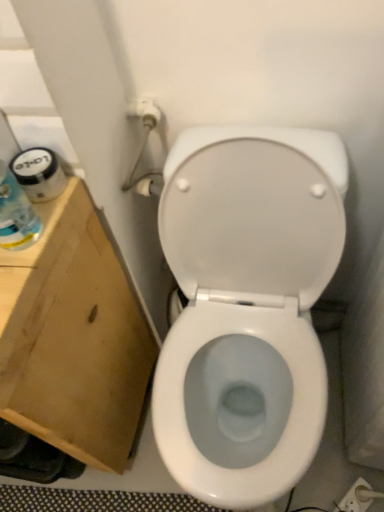
Question: From a real-world perspective, is white glossy toilet at center physically below translucent plastic bottle at left?

Choices:
 (A) no
 (B) yes

Answer: (B)

Question: Is white glossy toilet at center at the left side of translucent plastic bottle at left?

Choices:
 (A) no
 (B) yes

Answer: (A)

Question: Is white glossy toilet at center facing towards translucent plastic bottle at left?

Choices:
 (A) yes
 (B) no

Answer: (B)

Question: Considering the relative sizes of white glossy toilet at center and translucent plastic bottle at left in the image provided, is white glossy toilet at center wider than translucent plastic bottle at left?

Choices:
 (A) yes
 (B) no

Answer: (A)

Question: Is white glossy toilet at center positioned far away from translucent plastic bottle at left?

Choices:
 (A) yes
 (B) no

Answer: (B)

Question: Considering the relative sizes of white glossy toilet at center and translucent plastic bottle at left in the image provided, is white glossy toilet at center bigger than translucent plastic bottle at left?

Choices:
 (A) yes
 (B) no

Answer: (A)

Question: Can you confirm if brown cardboard at left is positioned to the left of white glossy toilet at center?

Choices:
 (A) yes
 (B) no

Answer: (A)

Question: Are brown cardboard at left and white glossy toilet at center far apart?

Choices:
 (A) yes
 (B) no

Answer: (B)

Question: Does brown cardboard at left have a larger size compared to white glossy toilet at center?

Choices:
 (A) no
 (B) yes

Answer: (B)

Question: From a real-world perspective, is brown cardboard at left located beneath white glossy toilet at center?

Choices:
 (A) yes
 (B) no

Answer: (B)

Question: Does brown cardboard at left have a lesser height compared to white glossy toilet at center?

Choices:
 (A) yes
 (B) no

Answer: (B)

Question: From the image's perspective, is brown cardboard at left located beneath white glossy toilet at center?

Choices:
 (A) yes
 (B) no

Answer: (A)

Question: Is the position of translucent plastic bottle at left more distant than that of brown cardboard at left?

Choices:
 (A) no
 (B) yes

Answer: (A)